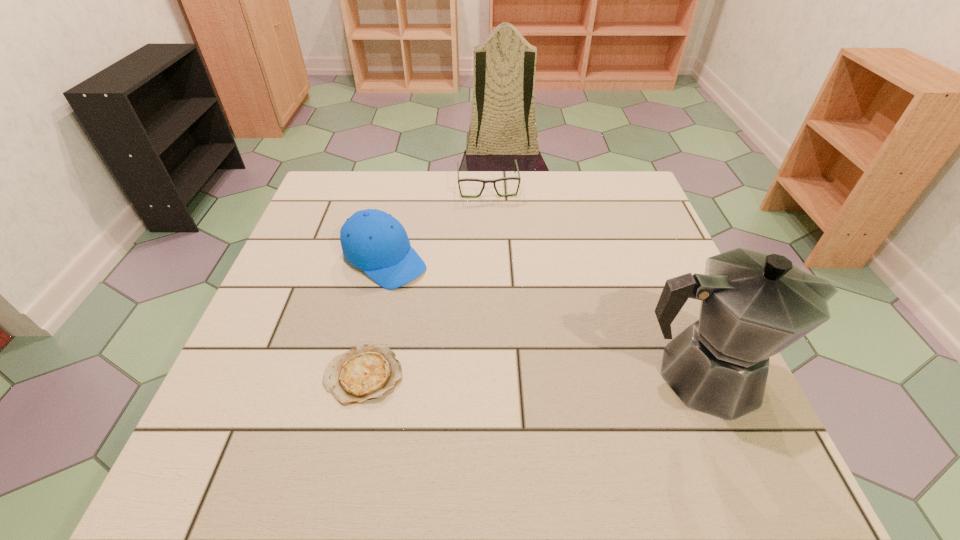
The image size is (960, 540). I want to click on vacant space on the desktop that is between the shortest object and the rightmost object and is positioned on the front-facing side of the second farthest object, so click(523, 375).

I want to click on vacant spot on the desktop that is between the shortest object and the coffeepot and is positioned on the lens of the third tallest object, so click(x=512, y=375).